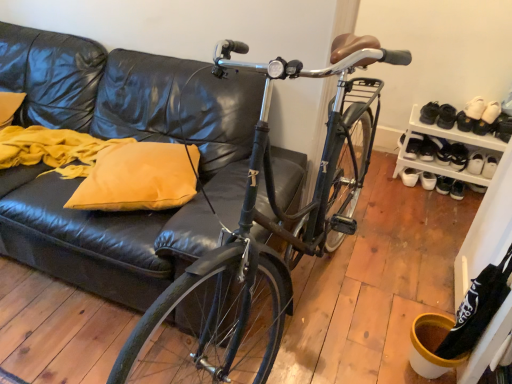
Find the location of a particular element. Image resolution: width=512 pixels, height=384 pixels. free point in front of white matte sneakers at lower right, which ranks as the 2th footwear in left-to-right order is located at coordinates (408, 191).